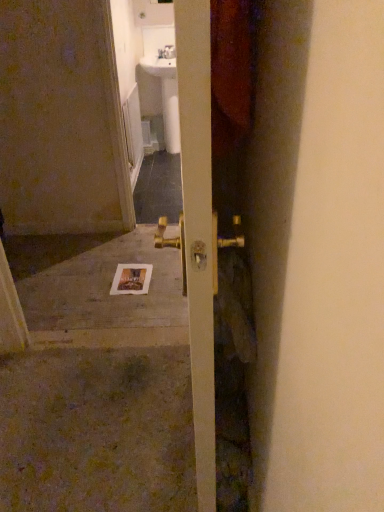
Question: Should I look upward or downward to see white concrete at center?

Choices:
 (A) down
 (B) up

Answer: (A)

Question: Can you confirm if white concrete at center is shorter than gold metallic door handle at center?

Choices:
 (A) yes
 (B) no

Answer: (A)

Question: Does white concrete at center lie in front of gold metallic door handle at center?

Choices:
 (A) yes
 (B) no

Answer: (B)

Question: Is gold metallic door handle at center a part of white concrete at center?

Choices:
 (A) no
 (B) yes

Answer: (A)

Question: Is white concrete at center taller than gold metallic door handle at center?

Choices:
 (A) no
 (B) yes

Answer: (A)

Question: Is white concrete at center not inside gold metallic door handle at center?

Choices:
 (A) yes
 (B) no

Answer: (A)

Question: From a real-world perspective, is white concrete at center positioned over gold metallic door handle at center based on gravity?

Choices:
 (A) no
 (B) yes

Answer: (A)

Question: From a real-world perspective, is white glossy sink at upper center positioned over white concrete at center based on gravity?

Choices:
 (A) no
 (B) yes

Answer: (B)

Question: From the image's perspective, is white glossy sink at upper center located beneath white concrete at center?

Choices:
 (A) no
 (B) yes

Answer: (A)

Question: Considering the relative sizes of white glossy sink at upper center and white concrete at center in the image provided, is white glossy sink at upper center thinner than white concrete at center?

Choices:
 (A) no
 (B) yes

Answer: (B)

Question: Is white glossy sink at upper center smaller than white concrete at center?

Choices:
 (A) yes
 (B) no

Answer: (B)

Question: Does white glossy sink at upper center contain white concrete at center?

Choices:
 (A) no
 (B) yes

Answer: (A)

Question: Considering the relative sizes of white glossy sink at upper center and white concrete at center in the image provided, is white glossy sink at upper center shorter than white concrete at center?

Choices:
 (A) no
 (B) yes

Answer: (A)

Question: Considering the relative positions of white paper postcard at center and gold metallic door handle at center in the image provided, is white paper postcard at center to the right of gold metallic door handle at center from the viewer's perspective?

Choices:
 (A) no
 (B) yes

Answer: (A)